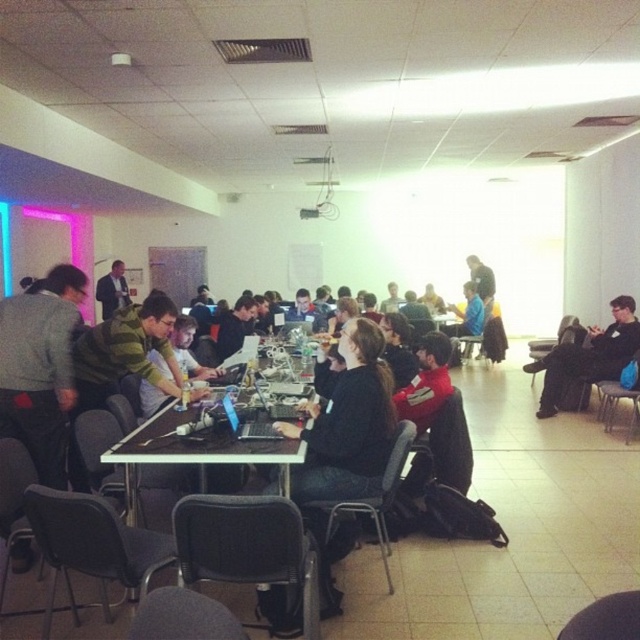
You are standing at the entrance of the conference room and see both the red fleece jacket at center and the dark gray suit at center. Which one is nearer to you?

The red fleece jacket at center is closer to the viewer than the dark gray suit at center.

You are standing at the center of the room and want to sit down. There is a black fabric chair at lower left located at point [92,545]. Is the chair to your left or right side?

The black fabric chair at lower left is located at point [92,545], which is to the left side of the observer standing at the center of the room.

You are organizing a workshop in this room and need to seat two people at the table. You have a metallic gray chair at center and a black plastic chair at right available. If you want to choose the wider chair for a person who needs more space, which chair should you pick?

The black plastic chair at right is wider than the metallic gray chair at center, so you should pick the black plastic chair at right for the person who needs more space.